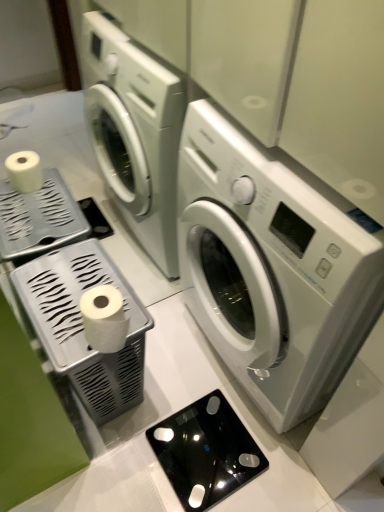
Locate an element on the screen. vacant region to the left of white glossy washing machine at center is located at coordinates (166, 382).